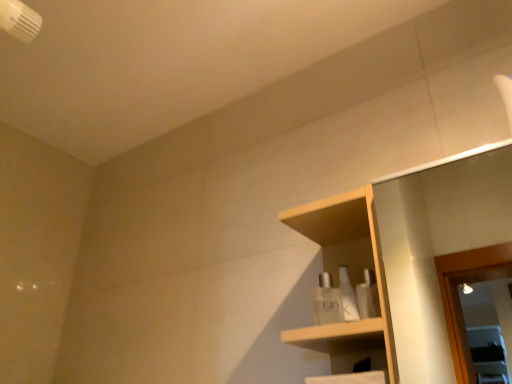
Question: Which direction should I rotate to look at white glossy bottles at center, which ranks as the 2th toiletry in back-to-front order, — up or down?

Choices:
 (A) down
 (B) up

Answer: (A)

Question: From a real-world perspective, is white glossy bottles at center, acting as the first toiletry starting from the front, under wooden shelf at center?

Choices:
 (A) yes
 (B) no

Answer: (A)

Question: Is white glossy bottles at center, which ranks as the 2th toiletry in back-to-front order, bigger than wooden shelf at center?

Choices:
 (A) yes
 (B) no

Answer: (B)

Question: Considering the relative sizes of white glossy bottles at center, acting as the first toiletry starting from the front, and wooden shelf at center in the image provided, is white glossy bottles at center, acting as the first toiletry starting from the front, smaller than wooden shelf at center?

Choices:
 (A) yes
 (B) no

Answer: (A)

Question: Considering the relative positions of white glossy bottles at center, acting as the first toiletry starting from the front, and wooden shelf at center in the image provided, is white glossy bottles at center, acting as the first toiletry starting from the front, to the left of wooden shelf at center from the viewer's perspective?

Choices:
 (A) no
 (B) yes

Answer: (B)

Question: Is white glossy bottles at center, which ranks as the 2th toiletry in back-to-front order, at the right side of wooden shelf at center?

Choices:
 (A) no
 (B) yes

Answer: (A)

Question: From a real-world perspective, is white glossy bottles at center, acting as the first toiletry starting from the front, on top of wooden shelf at center?

Choices:
 (A) no
 (B) yes

Answer: (A)

Question: Is clear glass perfume at center, which appears as the second toiletry when viewed from the front, bigger than white glossy bottles at center, acting as the first toiletry starting from the front?

Choices:
 (A) no
 (B) yes

Answer: (A)

Question: Is clear glass perfume at center, which appears as the second toiletry when viewed from the front, thinner than white glossy bottles at center, which ranks as the 2th toiletry in back-to-front order?

Choices:
 (A) no
 (B) yes

Answer: (B)

Question: Is clear glass perfume at center, which appears as the second toiletry when viewed from the front, far from white glossy bottles at center, which ranks as the 2th toiletry in back-to-front order?

Choices:
 (A) no
 (B) yes

Answer: (A)

Question: From a real-world perspective, does clear glass perfume at center, marked as the first toiletry in a back-to-front arrangement, sit lower than white glossy bottles at center, which ranks as the 2th toiletry in back-to-front order?

Choices:
 (A) no
 (B) yes

Answer: (A)

Question: Is clear glass perfume at center, which appears as the second toiletry when viewed from the front, positioned behind white glossy bottles at center, which ranks as the 2th toiletry in back-to-front order?

Choices:
 (A) yes
 (B) no

Answer: (A)

Question: Does clear glass perfume at center, marked as the first toiletry in a back-to-front arrangement, touch white glossy bottles at center, which ranks as the 2th toiletry in back-to-front order?

Choices:
 (A) yes
 (B) no

Answer: (A)

Question: Considering the relative sizes of white glossy bottles at center, which ranks as the 2th toiletry in back-to-front order, and clear glass perfume at center, which appears as the second toiletry when viewed from the front, in the image provided, is white glossy bottles at center, which ranks as the 2th toiletry in back-to-front order, shorter than clear glass perfume at center, which appears as the second toiletry when viewed from the front,?

Choices:
 (A) no
 (B) yes

Answer: (B)